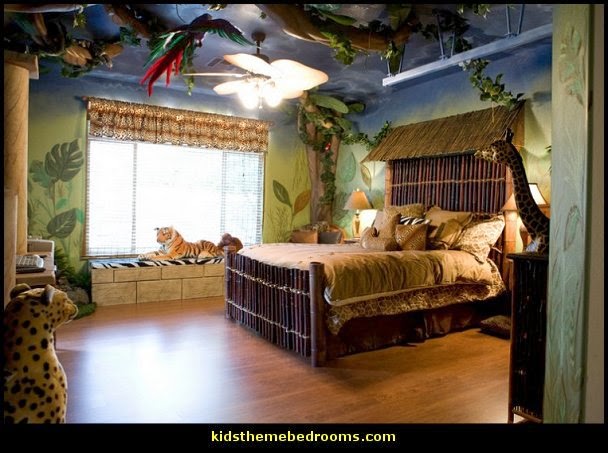
Find the location of a particular element. The width and height of the screenshot is (608, 453). dresser is located at coordinates (530, 277).